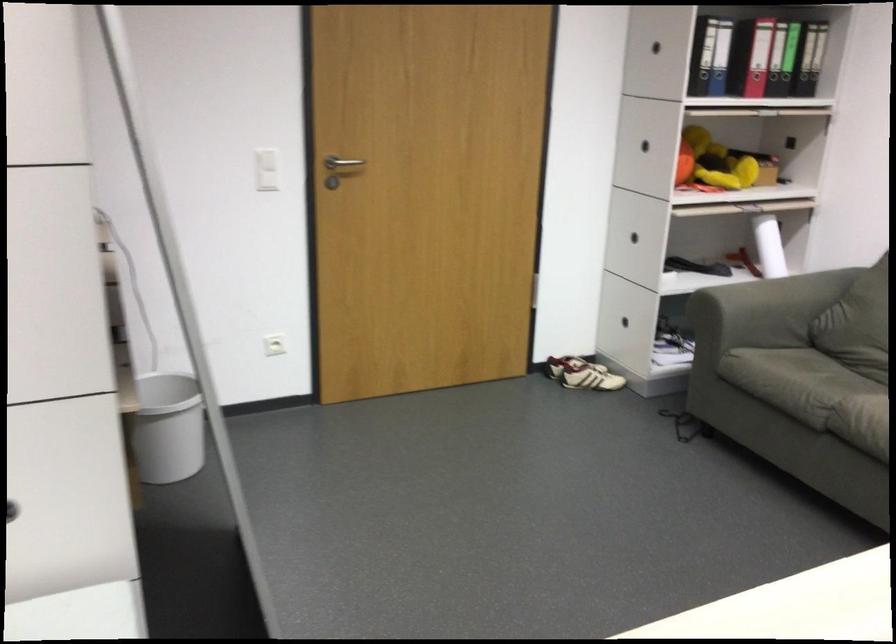
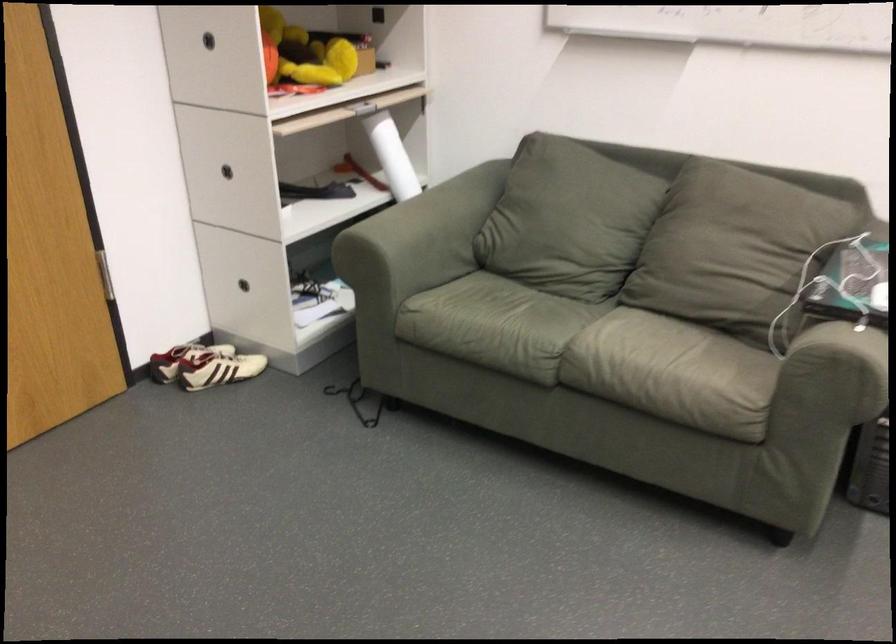
Where in the second image is the point corresponding to point (624, 228) from the first image?

(227, 171)